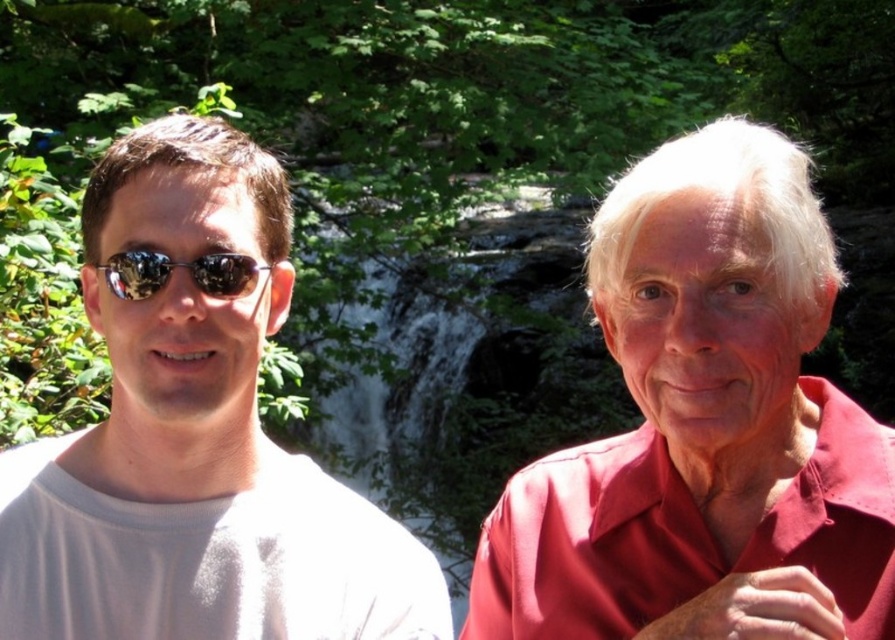
Which is more to the left, white matte shirt at left or sunglasses at left?

white matte shirt at left

Can you confirm if white matte shirt at left is positioned to the left of sunglasses at left?

Yes, white matte shirt at left is to the left of sunglasses at left.

Where is `white matte shirt at left`? white matte shirt at left is located at coordinates (195, 440).

Does matte red shirt at center appear on the right side of white matte shirt at left?

Yes, matte red shirt at center is to the right of white matte shirt at left.

Is matte red shirt at center closer to camera compared to white matte shirt at left?

Yes, matte red shirt at center is closer to the viewer.

At what (x,y) coordinates should I click in order to perform the action: click on matte red shirt at center. Please return your answer as a coordinate pair (x, y). This screenshot has height=640, width=895. Looking at the image, I should click on (700, 413).

Is matte red shirt at center taller than sunglasses at left?

Yes.

Which is in front, point (695, 400) or point (125, 289)?

Point (695, 400) is in front.

Is point (782, 172) in front of point (142, 266)?

That is False.

Locate an element on the screen. matte red shirt at center is located at coordinates (700, 413).